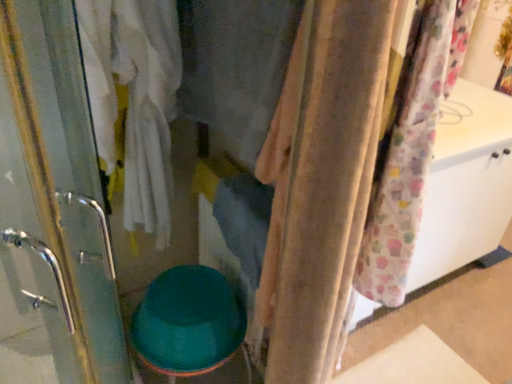
Question: Does teal glossy toilet bowl at center touch beige fabric curtain at center?

Choices:
 (A) no
 (B) yes

Answer: (A)

Question: Can you confirm if teal glossy toilet bowl at center is wider than beige fabric curtain at center?

Choices:
 (A) yes
 (B) no

Answer: (A)

Question: Considering the relative positions of teal glossy toilet bowl at center and beige fabric curtain at center in the image provided, is teal glossy toilet bowl at center to the left of beige fabric curtain at center from the viewer's perspective?

Choices:
 (A) no
 (B) yes

Answer: (B)

Question: From the image's perspective, is teal glossy toilet bowl at center under beige fabric curtain at center?

Choices:
 (A) no
 (B) yes

Answer: (B)

Question: From a real-world perspective, is teal glossy toilet bowl at center positioned over beige fabric curtain at center based on gravity?

Choices:
 (A) no
 (B) yes

Answer: (A)

Question: Based on their sizes in the image, would you say teal glossy toilet bowl at center is bigger or smaller than velvet fabric at center?

Choices:
 (A) small
 (B) big

Answer: (B)

Question: From the image's perspective, is teal glossy toilet bowl at center located above or below velvet fabric at center?

Choices:
 (A) above
 (B) below

Answer: (B)

Question: Based on their positions, is teal glossy toilet bowl at center located to the left or right of velvet fabric at center?

Choices:
 (A) left
 (B) right

Answer: (A)

Question: Is teal glossy toilet bowl at center inside the boundaries of velvet fabric at center, or outside?

Choices:
 (A) inside
 (B) outside

Answer: (B)

Question: Is teal glossy toilet bowl at center bigger or smaller than beige fabric curtain at center?

Choices:
 (A) big
 (B) small

Answer: (A)

Question: From the image's perspective, relative to beige fabric curtain at center, is teal glossy toilet bowl at center above or below?

Choices:
 (A) below
 (B) above

Answer: (A)

Question: In terms of width, does teal glossy toilet bowl at center look wider or thinner when compared to beige fabric curtain at center?

Choices:
 (A) thin
 (B) wide

Answer: (B)

Question: Choose the correct answer: Is teal glossy toilet bowl at center inside beige fabric curtain at center or outside it?

Choices:
 (A) inside
 (B) outside

Answer: (B)

Question: Considering the positions of velvet fabric at center and beige fabric curtain at center in the image, is velvet fabric at center wider or thinner than beige fabric curtain at center?

Choices:
 (A) wide
 (B) thin

Answer: (B)

Question: Looking at the image, does velvet fabric at center seem bigger or smaller compared to beige fabric curtain at center?

Choices:
 (A) small
 (B) big

Answer: (A)